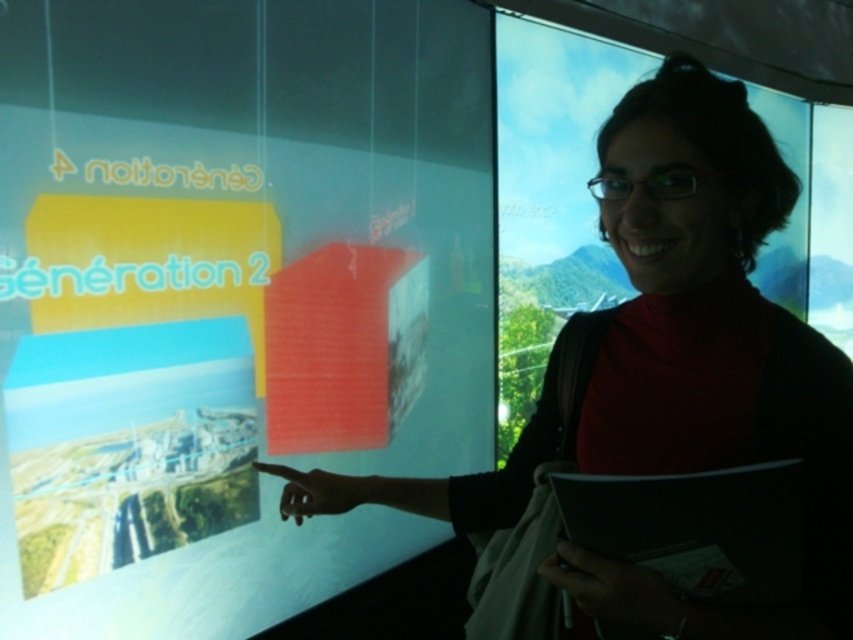
You are designing a layout for a presentation and need to ensure that the matte plastic screen at center can display all content without overlapping with the matte black sweater at center. Given that the screen is larger, how should you position the content to avoid overlap?

Since the matte plastic screen at center is larger than the matte black sweater at center, position the content towards the edges or corners of the screen to ensure it doesn not overlap with the sweater.

You are a photographer trying to capture a clear image of both the matte plastic screen at center and the matte black sweater at center. Since the screen is backlit, you need to adjust your camera settings. Which object should you focus on first to ensure proper exposure?

The matte plastic screen at center is positioned on the left side of matte black sweater at center, so you should focus on the matte plastic screen at center first to balance the exposure between the bright screen and the darker sweater.

Based on the photo, you are a photographer trying to capture a clear shot of the matte plastic screen at center without the matte black sweater at center appearing in the frame. Based on their positions, is this possible?

The matte plastic screen at center is positioned over the matte black sweater at center, so it is not possible to capture the screen without the sweater appearing in the frame as they are layered directly on top of each other.